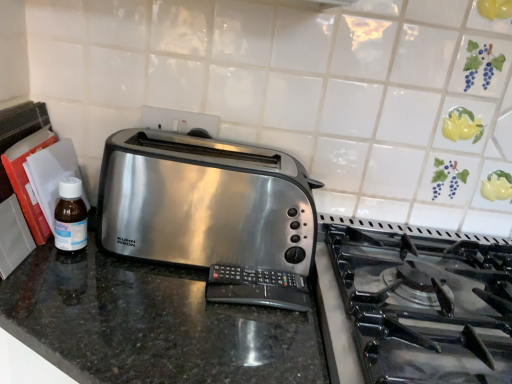
Question: Should I look upward or downward to see shiny granite counter at center?

Choices:
 (A) up
 (B) down

Answer: (B)

Question: Can you confirm if shiny granite counter at center is thinner than satin metallic toaster at center?

Choices:
 (A) no
 (B) yes

Answer: (A)

Question: Is shiny granite counter at center placed right next to satin metallic toaster at center?

Choices:
 (A) yes
 (B) no

Answer: (B)

Question: Can we say shiny granite counter at center lies outside satin metallic toaster at center?

Choices:
 (A) yes
 (B) no

Answer: (A)

Question: Is satin metallic toaster at center surrounded by shiny granite counter at center?

Choices:
 (A) no
 (B) yes

Answer: (A)

Question: Does shiny granite counter at center appear on the left side of satin metallic toaster at center?

Choices:
 (A) no
 (B) yes

Answer: (B)

Question: Is satin metallic toaster at center at the back of shiny granite counter at center?

Choices:
 (A) yes
 (B) no

Answer: (B)

Question: Is shiny granite counter at center not inside translucent plastic bottle at left?

Choices:
 (A) yes
 (B) no

Answer: (A)

Question: From the image's perspective, does shiny granite counter at center appear lower than translucent plastic bottle at left?

Choices:
 (A) yes
 (B) no

Answer: (A)

Question: Can you confirm if shiny granite counter at center is taller than translucent plastic bottle at left?

Choices:
 (A) no
 (B) yes

Answer: (B)

Question: Does shiny granite counter at center have a lesser width compared to translucent plastic bottle at left?

Choices:
 (A) yes
 (B) no

Answer: (B)

Question: Is shiny granite counter at center at the right side of translucent plastic bottle at left?

Choices:
 (A) yes
 (B) no

Answer: (A)

Question: Considering the relative sizes of shiny granite counter at center and translucent plastic bottle at left in the image provided, is shiny granite counter at center smaller than translucent plastic bottle at left?

Choices:
 (A) yes
 (B) no

Answer: (B)

Question: Does satin metallic toaster at center appear on the left side of translucent plastic bottle at left?

Choices:
 (A) no
 (B) yes

Answer: (A)